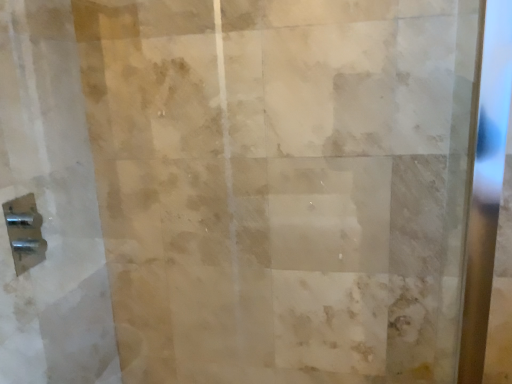
Locate an element on the screen. Image resolution: width=512 pixels, height=384 pixels. polished chrome door handle at lower left is located at coordinates (24, 232).

What do you see at coordinates (24, 232) in the screenshot? I see `polished chrome door handle at lower left` at bounding box center [24, 232].

This screenshot has height=384, width=512. Identify the location of polished chrome door handle at lower left. (24, 232).